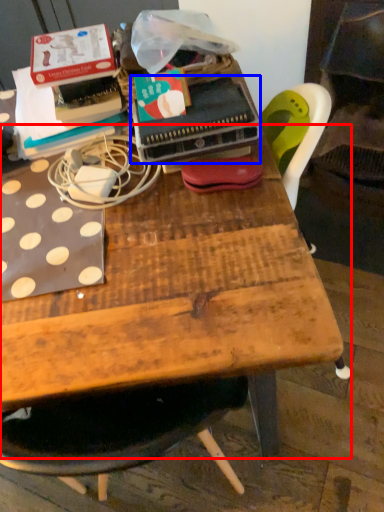
Question: Among these objects, which one is nearest to the camera, table (highlighted by a red box) or paperback book (highlighted by a blue box)?

Choices:
 (A) table
 (B) paperback book

Answer: (B)